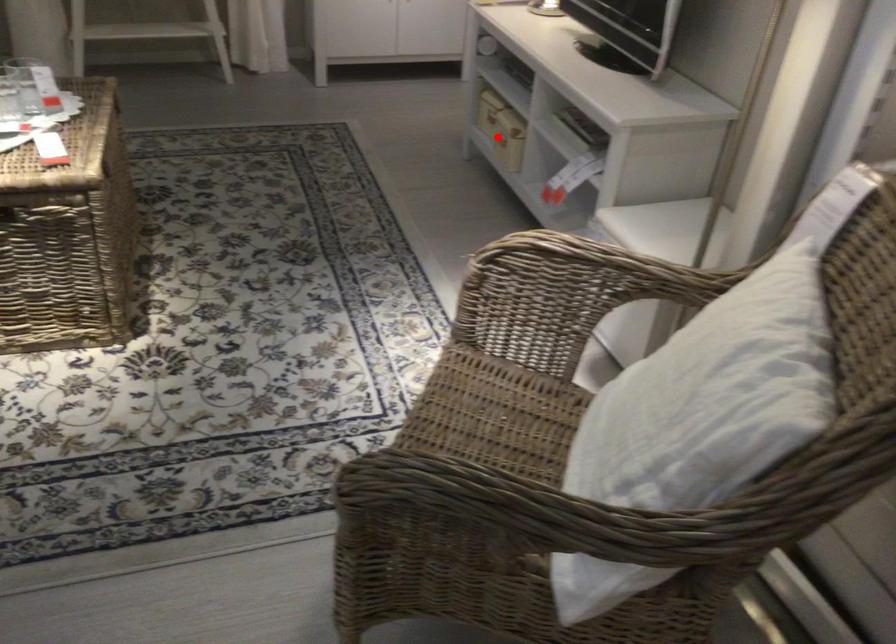
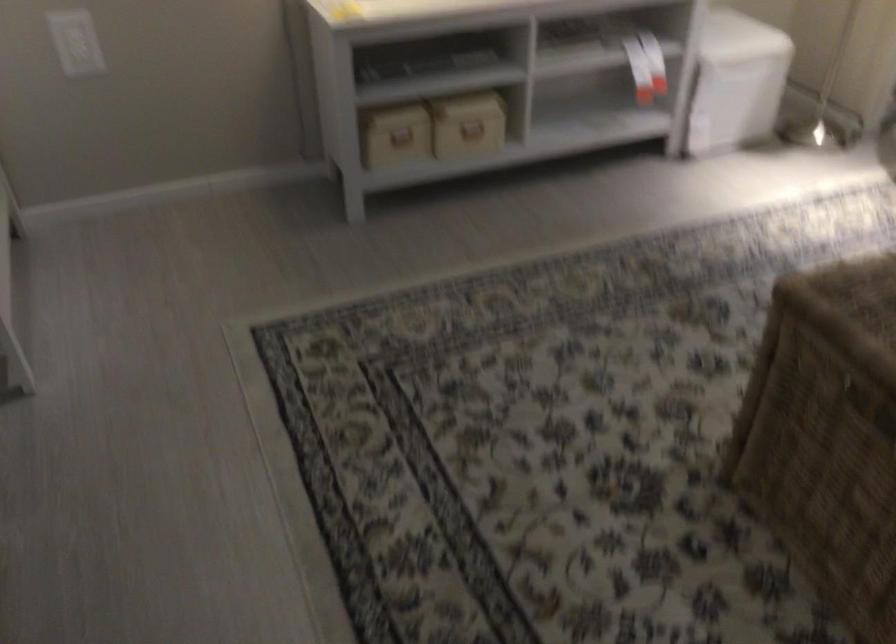
In the second image, find the point that corresponds to the highlighted location in the first image.

(472, 131)